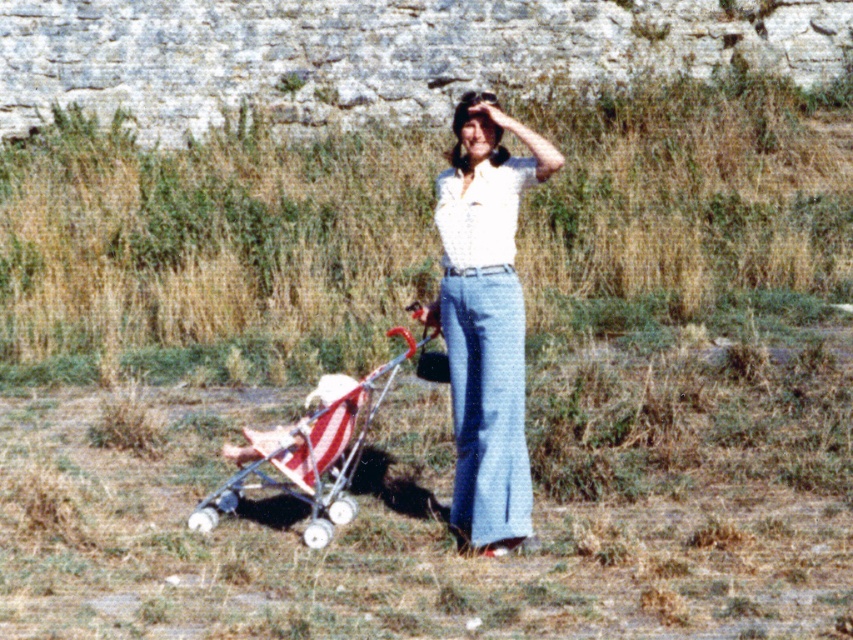
Which is below, red striped fabric stroller at lower left or red and white striped fabric stroller at lower left?

red striped fabric stroller at lower left is below.

Which is in front, point (323, 470) or point (276, 432)?

Point (323, 470)

Which is behind, point (350, 387) or point (242, 456)?

The point (242, 456) is more distant.

Find the location of a particular element. red striped fabric stroller at lower left is located at coordinates (315, 448).

Is white cotton blouse at center bigger than red striped fabric stroller at lower left?

Incorrect, white cotton blouse at center is not larger than red striped fabric stroller at lower left.

Is white cotton blouse at center further to the viewer compared to red striped fabric stroller at lower left?

No, white cotton blouse at center is in front of red striped fabric stroller at lower left.

Which is in front, point (469, 472) or point (311, 396)?

Positioned in front is point (469, 472).

Identify the location of white cotton blouse at center. (486, 320).

Image resolution: width=853 pixels, height=640 pixels. I want to click on white cotton blouse at center, so click(486, 320).

Is white cotton blouse at center taller than red and white striped fabric stroller at lower left?

Indeed, white cotton blouse at center has a greater height compared to red and white striped fabric stroller at lower left.

Between point (515, 321) and point (288, 436), which one is positioned in front?

Positioned in front is point (515, 321).

Locate an element on the screen. white cotton blouse at center is located at coordinates (486, 320).